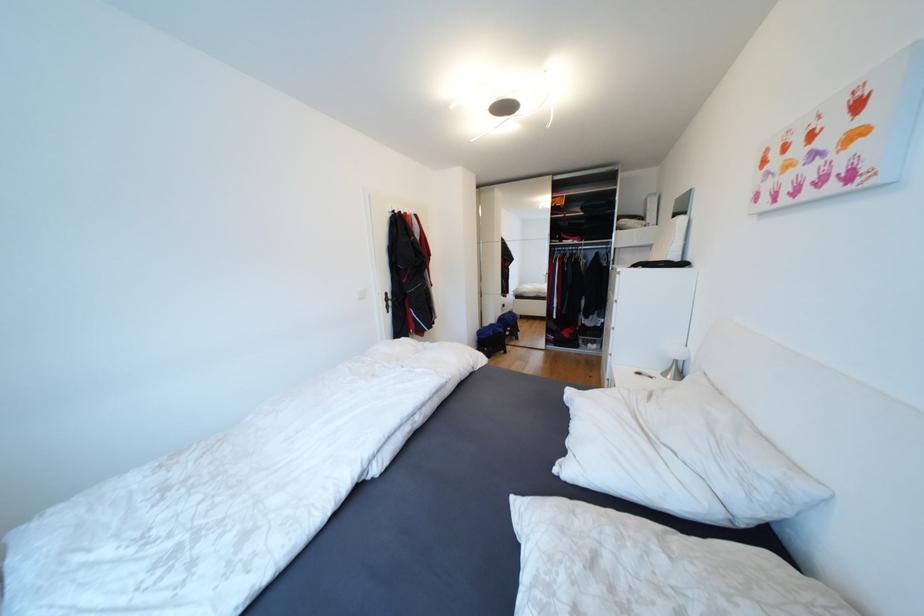
At what (x,y) coordinates should I click in order to perform the action: click on white drawer. Please return your answer as a coordinate pair (x, y). The image size is (924, 616). Looking at the image, I should click on (647, 315).